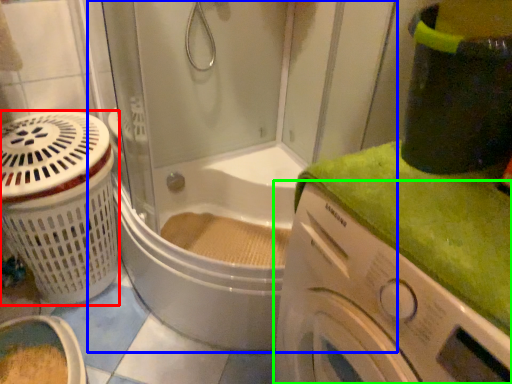
Question: Estimate the real-world distances between objects in this image. Which object is closer to basket (highlighted by a red box), shower door (highlighted by a blue box) or washing machine (highlighted by a green box)?

Choices:
 (A) shower door
 (B) washing machine

Answer: (A)